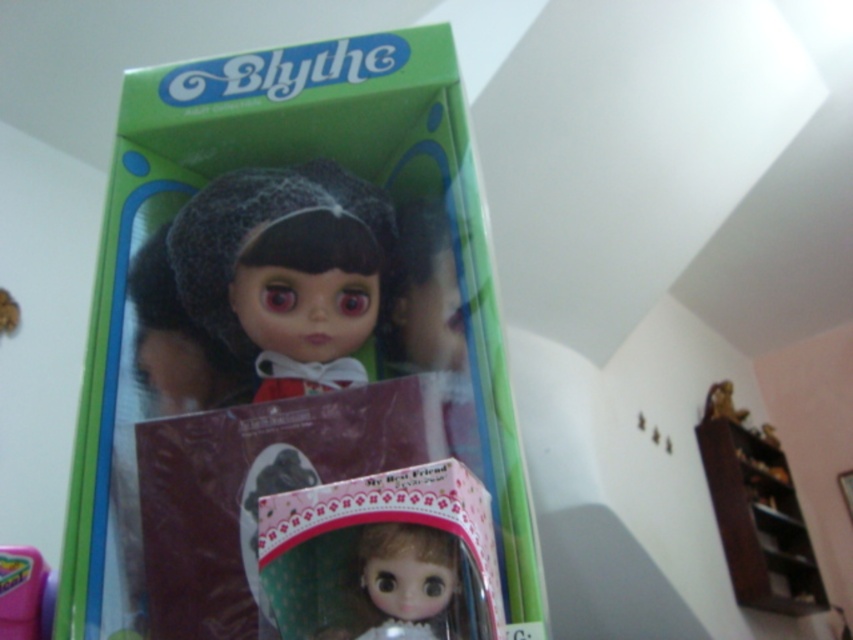
You are a collector examining the Blythe doll box. You notice the satin black doll at center and the matte plastic toy at lower left. Which object is closer to you when looking at the box?

The satin black doll at center is closer to you than the matte plastic toy at lower left because it is positioned further to the viewer.

You are a toy collector who wants to place the satin black doll at center on a shelf. The shelf has a mark at coordinates 0.425 on the x and 0.335 on the y axis. Can you confirm if placing the doll exactly at those coordinates will align it with the mark?

Yes, the satin black doll at center is located at the coordinates 0.425 on the x axis and 0.335 on the y axis, so placing it there will align perfectly with the mark.